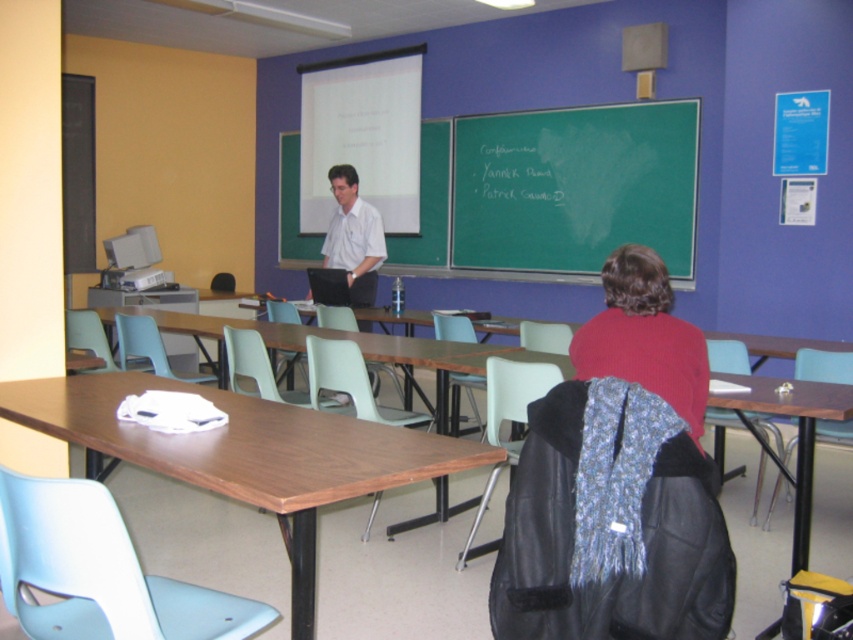
Question: Is green chalkboard at center below red knit sweater at center?

Choices:
 (A) no
 (B) yes

Answer: (A)

Question: Does green chalkboard at center appear on the left side of wooden table at lower left?

Choices:
 (A) no
 (B) yes

Answer: (A)

Question: Based on their relative distances, which object is farther from the red knit sweater at center?

Choices:
 (A) white shirt at center
 (B) green chalkboard at center
 (C) wooden table at lower left

Answer: (B)

Question: Can you confirm if wooden table at lower left is positioned above red knit sweater at center?

Choices:
 (A) yes
 (B) no

Answer: (B)

Question: Which point is farther to the camera?

Choices:
 (A) white shirt at center
 (B) red knit sweater at center
 (C) wooden table at lower left
 (D) green chalkboard at center

Answer: (D)

Question: Which point appears closest to the camera in this image?

Choices:
 (A) (677, 264)
 (B) (670, 356)
 (C) (436, 477)
 (D) (376, 252)

Answer: (B)